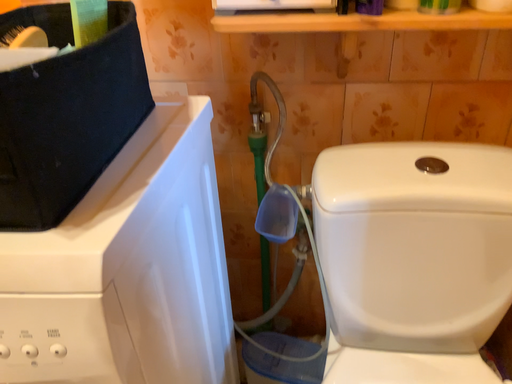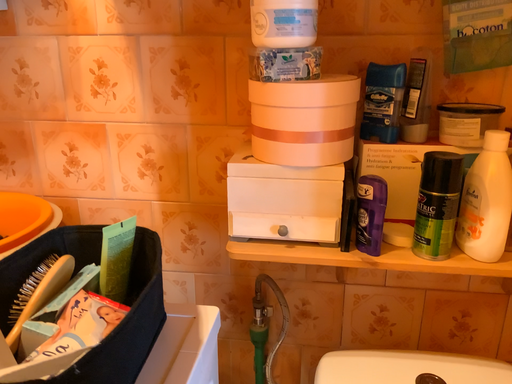
Question: How did the camera likely rotate when shooting the video?

Choices:
 (A) rotated downward
 (B) rotated upward

Answer: (B)